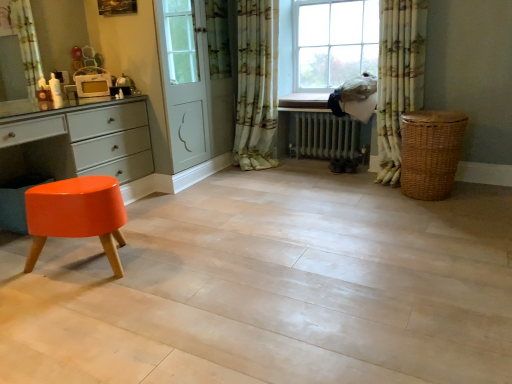
At what (x,y) coordinates should I click in order to perform the action: click on vacant area that is in front of orange glossy stool at lower left. Please return your answer as a coordinate pair (x, y). The image size is (512, 384). Looking at the image, I should click on (77, 316).